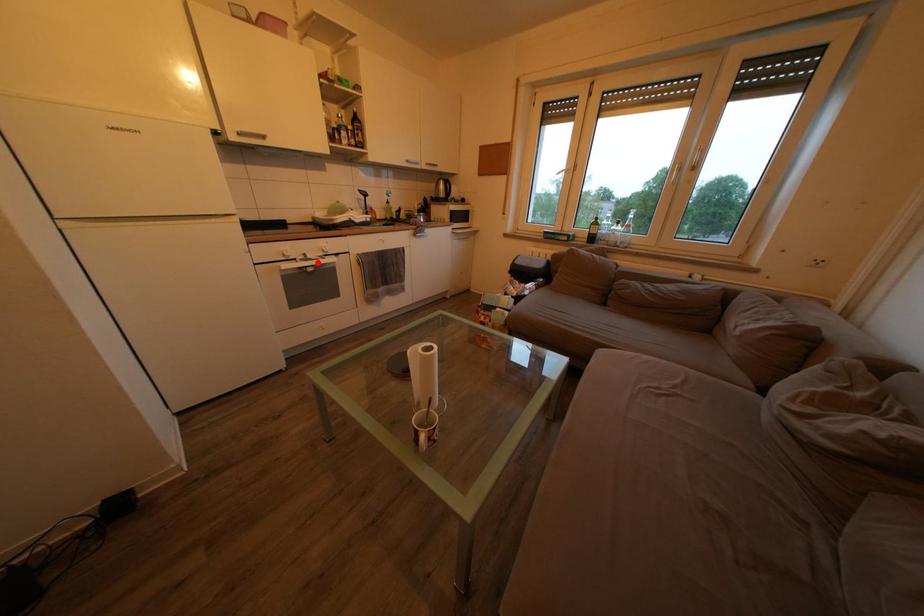
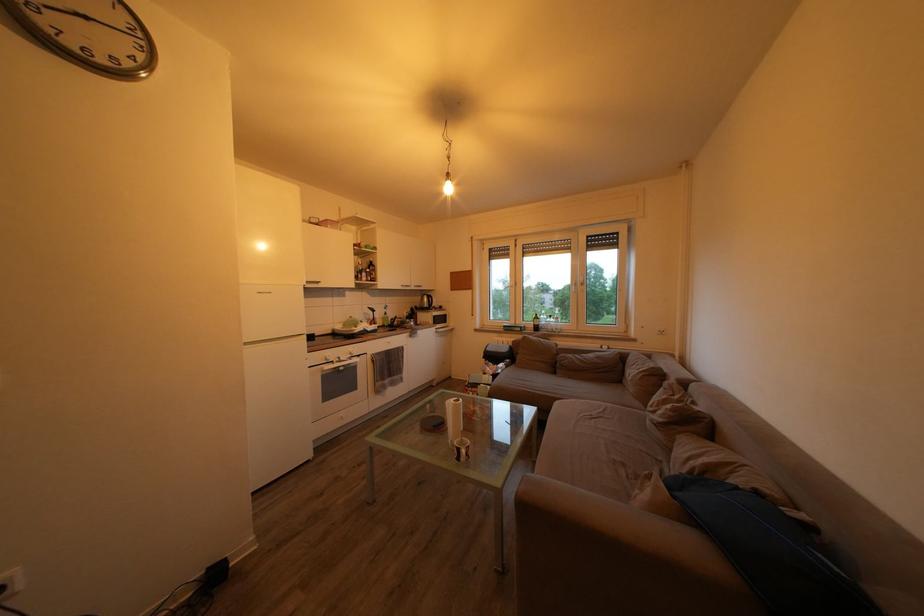
Find the pixel in the second image that matches the highlighted location in the first image.

(349, 363)